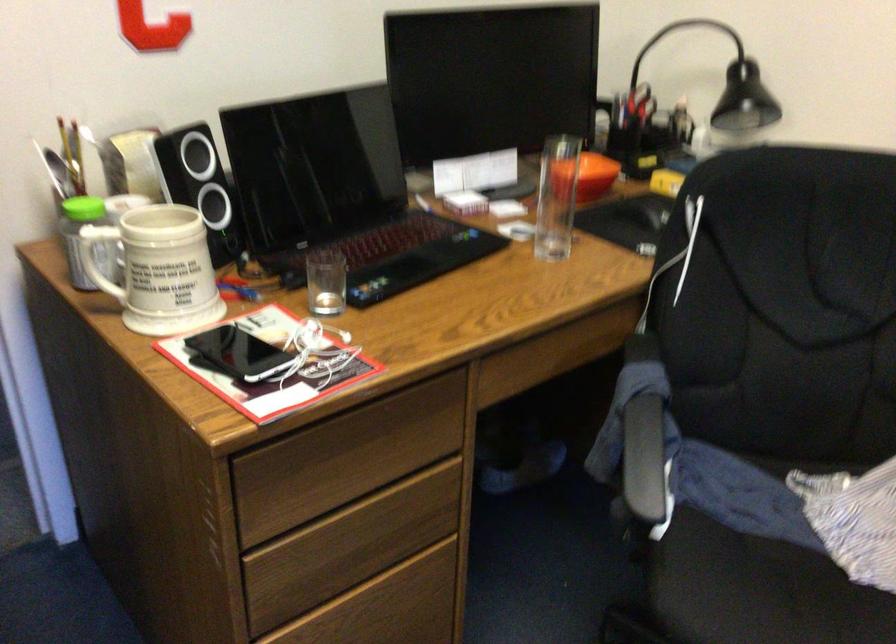
The height and width of the screenshot is (644, 896). What do you see at coordinates (93, 257) in the screenshot? I see `the white stein handle` at bounding box center [93, 257].